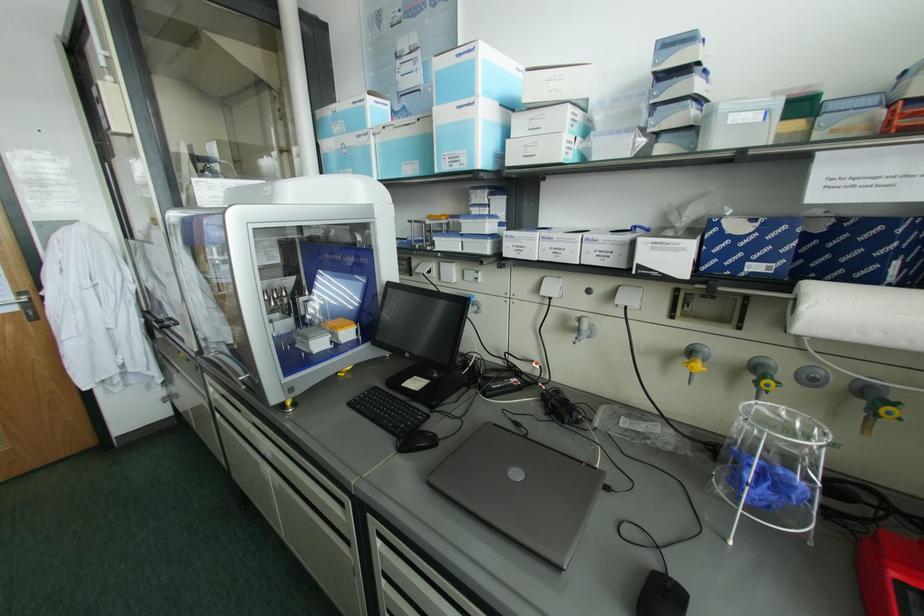
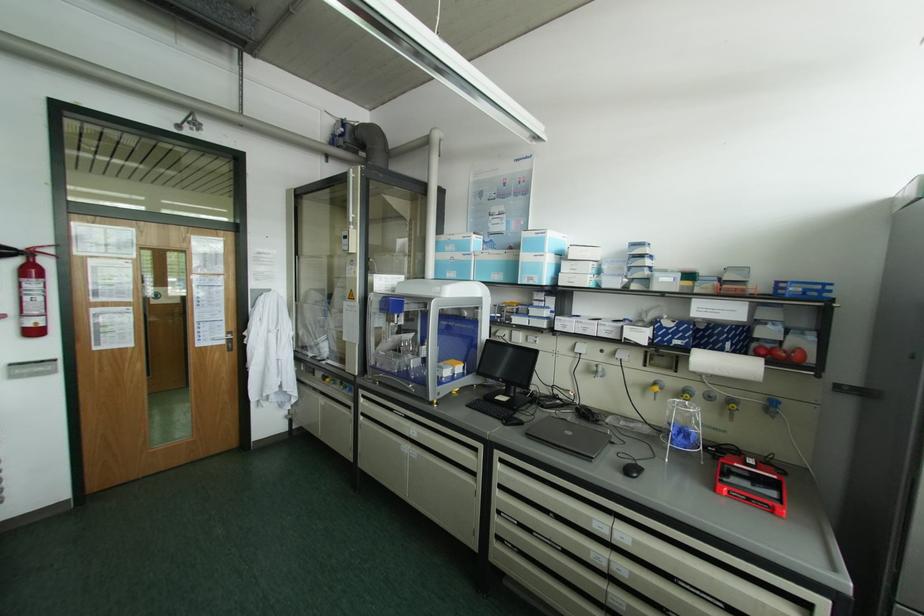
In a continuous first-person perspective shot, in which direction is the camera moving?

The movement direction of the cameraman is left, backward.